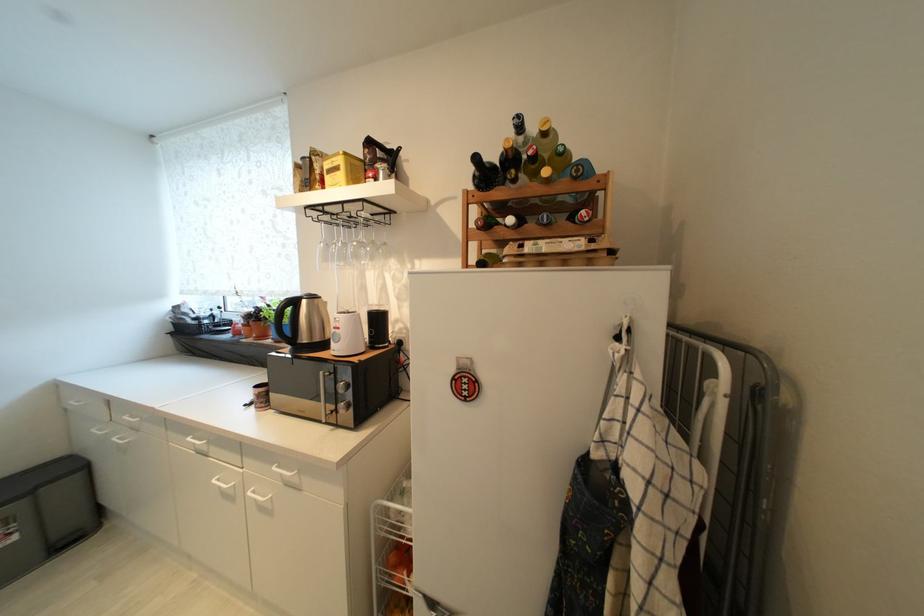
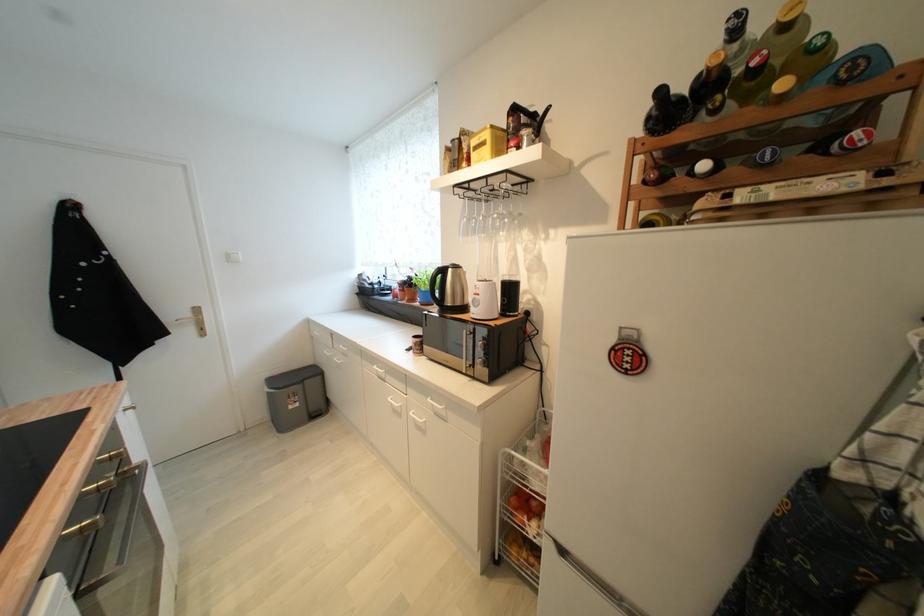
Where in the second image is the point corresponding to (x=516, y=222) from the first image?

(709, 168)